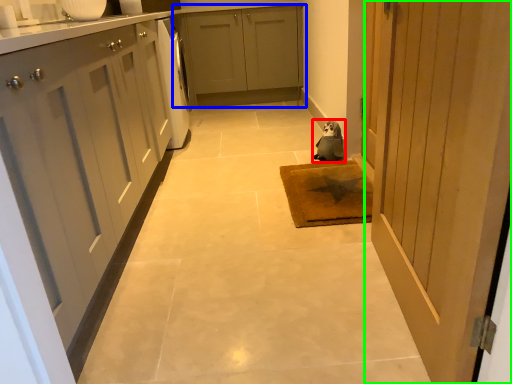
Question: Estimate the real-world distances between objects in this image. Which object is farther from animal (highlighted by a red box), cabinetry (highlighted by a blue box) or door (highlighted by a green box)?

Choices:
 (A) cabinetry
 (B) door

Answer: (A)